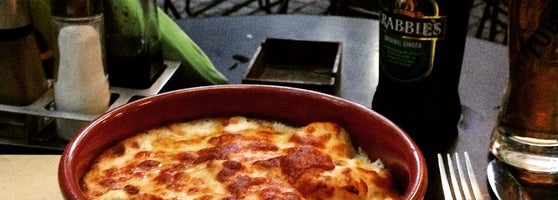
Where is `gold border`? The width and height of the screenshot is (558, 200). gold border is located at coordinates (435, 8), (423, 78).